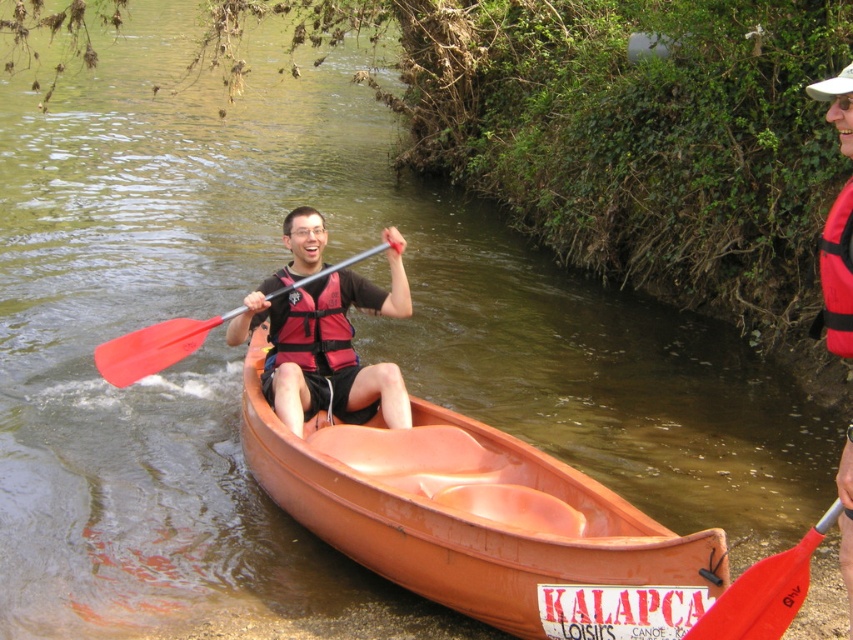
Question: Is orange plastic canoe at center to the left of red rubber paddle at lower right from the viewer's perspective?

Choices:
 (A) no
 (B) yes

Answer: (B)

Question: Does orange plastic canoe at center have a smaller size compared to red plastic paddle at center?

Choices:
 (A) no
 (B) yes

Answer: (A)

Question: Which is farther from the red rubber paddle at lower right?

Choices:
 (A) matte red life vest at center
 (B) red life vest at center
 (C) red nylon life jacket at right

Answer: (A)

Question: Which point is closer to the camera?

Choices:
 (A) (281, 400)
 (B) (161, 364)
 (C) (317, 353)
 (D) (788, 600)

Answer: (D)

Question: Can you confirm if orange plastic canoe at center is smaller than red matte life jacket at center?

Choices:
 (A) yes
 (B) no

Answer: (B)

Question: Among these points, which one is nearest to the camera?

Choices:
 (A) (718, 625)
 (B) (833, 237)
 (C) (352, 364)

Answer: (B)